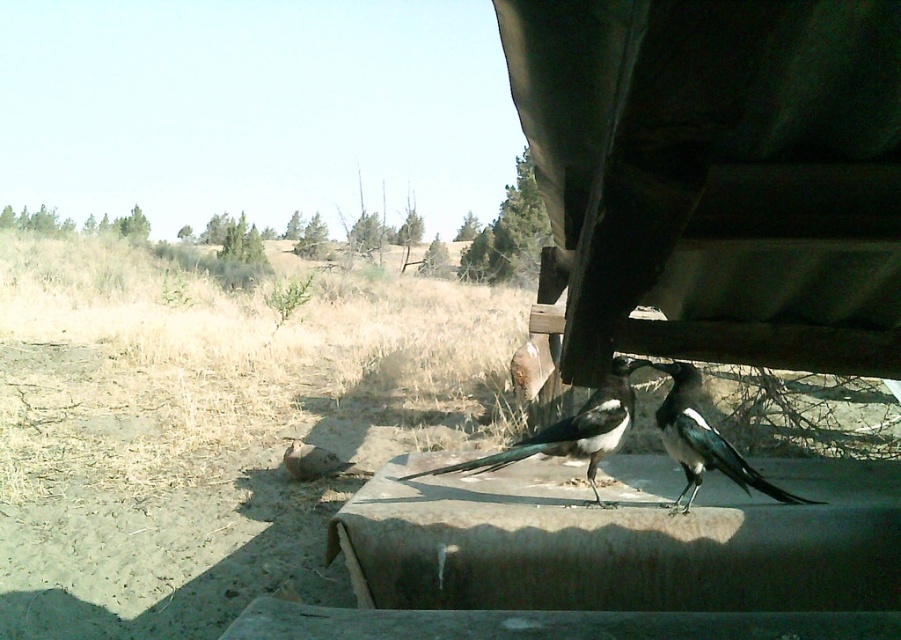
Question: Considering the relative positions of black glossy magpie at center and black glossy magpie at lower right in the image provided, where is black glossy magpie at center located with respect to black glossy magpie at lower right?

Choices:
 (A) left
 (B) right

Answer: (A)

Question: From the image, what is the correct spatial relationship of black glossy magpie at center in relation to black glossy magpie at lower right?

Choices:
 (A) left
 (B) right

Answer: (A)

Question: Which point is closer to the camera taking this photo?

Choices:
 (A) (702, 433)
 (B) (585, 403)

Answer: (A)

Question: Does black glossy magpie at center appear on the right side of black glossy magpie at lower right?

Choices:
 (A) no
 (B) yes

Answer: (A)